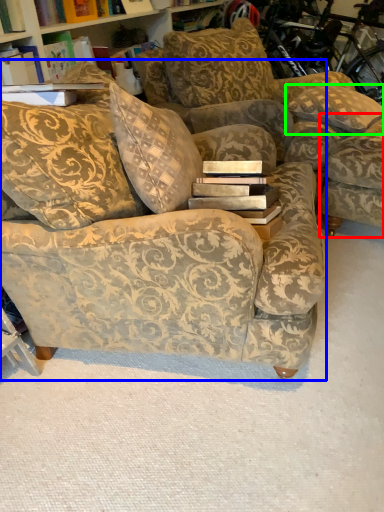
Question: Which is nearer to the swivel chair (highlighted by a red box)? studio couch (highlighted by a blue box) or pillow (highlighted by a green box).

Choices:
 (A) studio couch
 (B) pillow

Answer: (B)